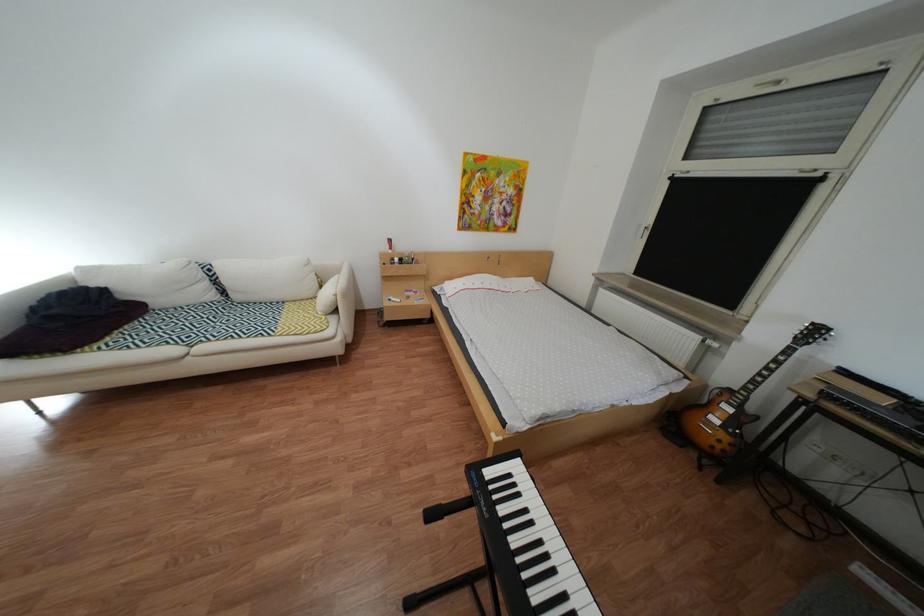
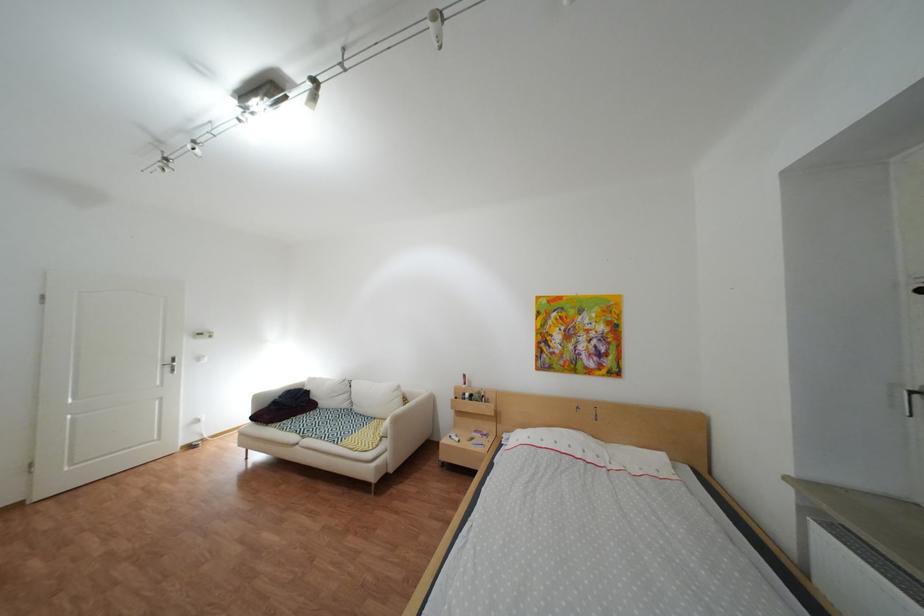
The point at (x=113, y=346) is marked in the first image. Where is the corresponding point in the second image?

(294, 424)